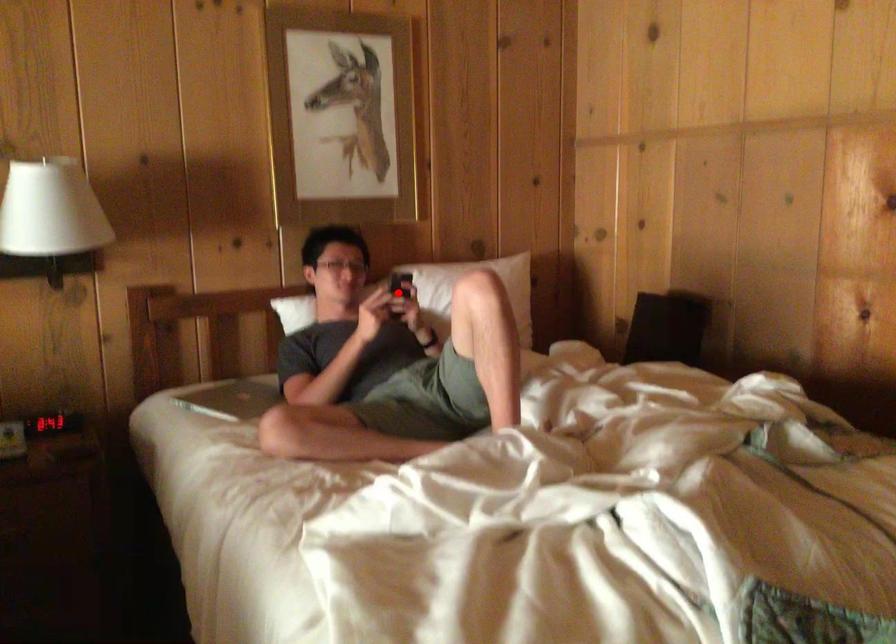
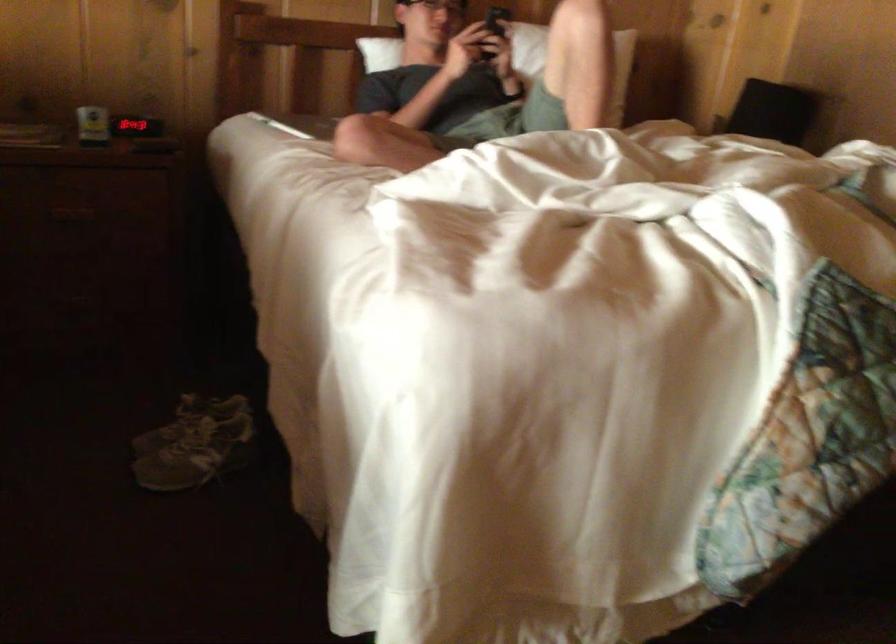
Find the pixel in the second image that matches the highlighted location in the first image.

(495, 24)